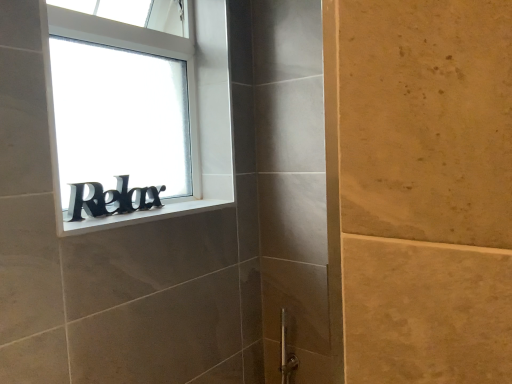
Question: Considering the relative sizes of white matte window sill at upper left and black matte sign at window in the image provided, is white matte window sill at upper left wider than black matte sign at window?

Choices:
 (A) no
 (B) yes

Answer: (B)

Question: Is white matte window sill at upper left smaller than black matte sign at window?

Choices:
 (A) no
 (B) yes

Answer: (B)

Question: From a real-world perspective, is white matte window sill at upper left over black matte sign at window?

Choices:
 (A) yes
 (B) no

Answer: (B)

Question: Is white matte window sill at upper left at the left side of black matte sign at window?

Choices:
 (A) yes
 (B) no

Answer: (B)

Question: Can you confirm if white matte window sill at upper left is taller than black matte sign at window?

Choices:
 (A) no
 (B) yes

Answer: (A)

Question: Is white matte window sill at upper left touching black matte sign at window?

Choices:
 (A) yes
 (B) no

Answer: (A)

Question: Does black matte sign at window have a greater height compared to white matte window sill at upper left?

Choices:
 (A) no
 (B) yes

Answer: (B)

Question: Is black matte sign at window outside of white matte window sill at upper left?

Choices:
 (A) yes
 (B) no

Answer: (A)

Question: From the image's perspective, is black matte sign at window on white matte window sill at upper left?

Choices:
 (A) yes
 (B) no

Answer: (A)

Question: Can you confirm if black matte sign at window is positioned to the right of white matte window sill at upper left?

Choices:
 (A) yes
 (B) no

Answer: (B)

Question: Is the position of black matte sign at window less distant than that of white matte window sill at upper left?

Choices:
 (A) yes
 (B) no

Answer: (B)

Question: Can you see black matte sign at window touching white matte window sill at upper left?

Choices:
 (A) no
 (B) yes

Answer: (B)

Question: Is white matte window sill at upper left at the right side of black matte sign at upper left?

Choices:
 (A) no
 (B) yes

Answer: (B)